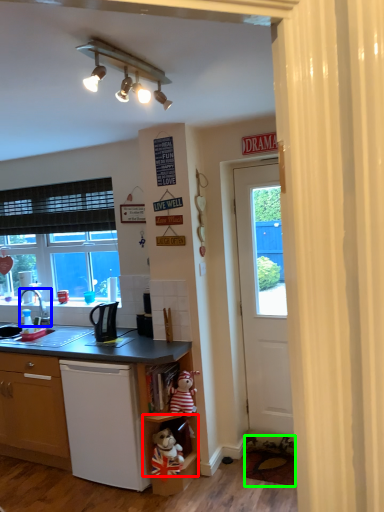
Question: Based on their relative distances, which object is farther from shelf (highlighted by a red box)? Choose from faucet (highlighted by a blue box) and carpets (highlighted by a green box).

Choices:
 (A) faucet
 (B) carpets

Answer: (A)